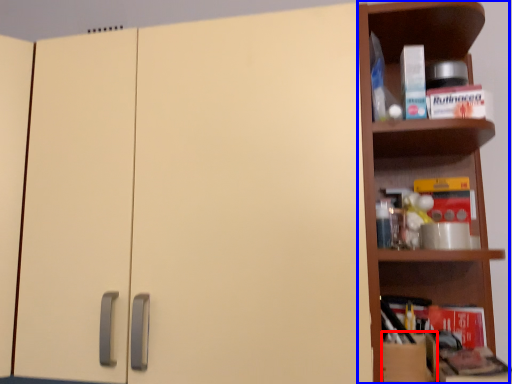
Question: Which point is closer to the camera, cardboard box (highlighted by a red box) or shelf (highlighted by a blue box)?

Choices:
 (A) cardboard box
 (B) shelf

Answer: (B)